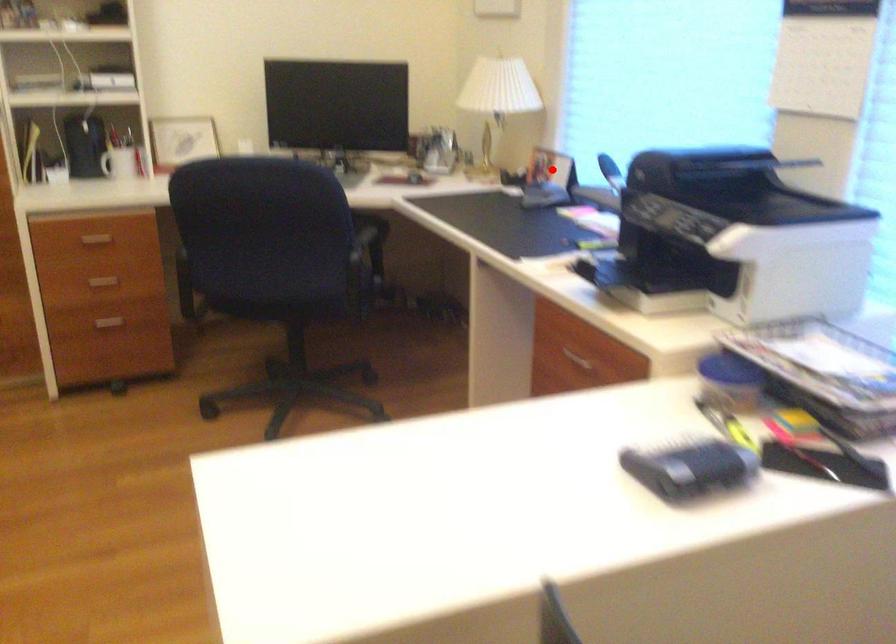
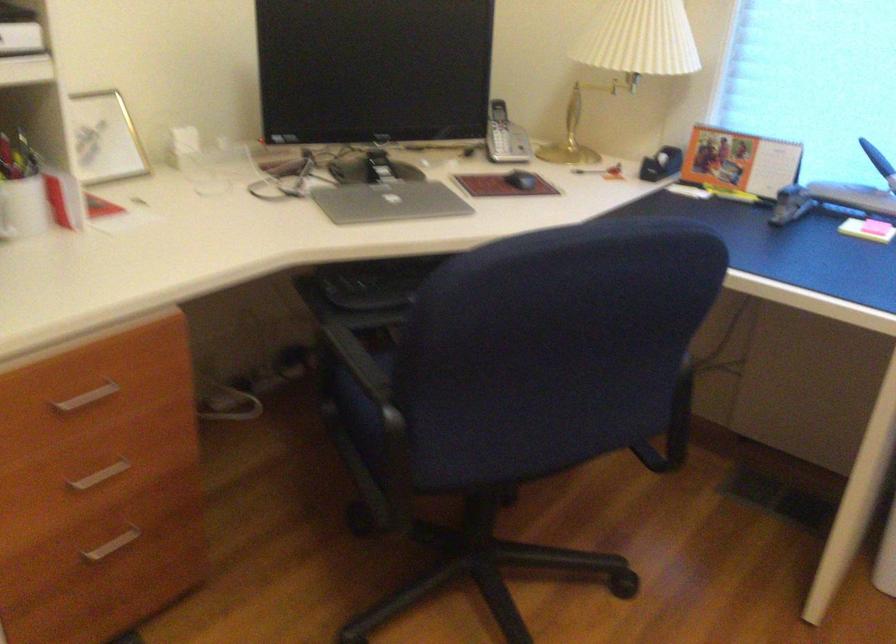
Question: I am providing you with two images of the same scene from different viewpoints. A red point is marked on the first image. At the location where the point appears in image 1, is it still visible in image 2?

Choices:
 (A) Yes
 (B) No

Answer: (A)